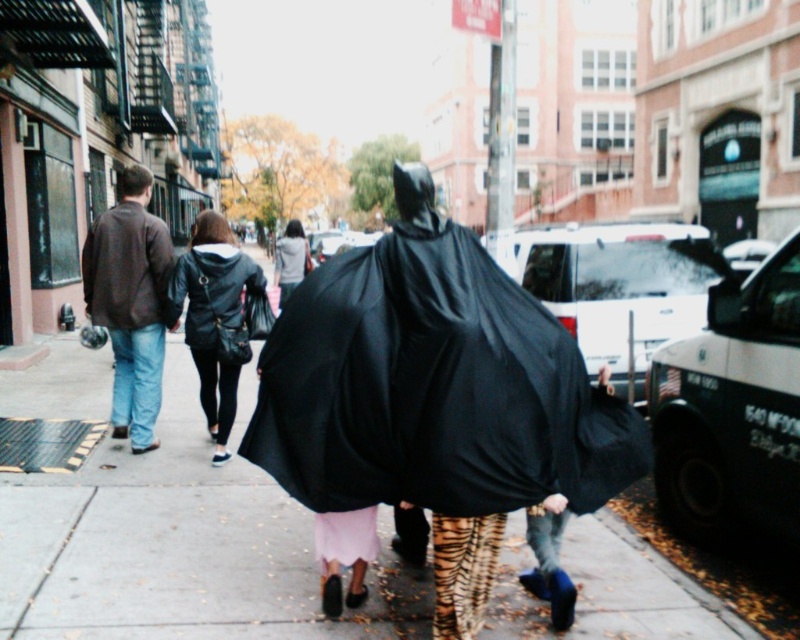
You are a pedestrian standing on the gray concrete sidewalk at center and want to walk towards the light gray hoodie at center. Which direction should you move to reach them?

The gray concrete sidewalk at center is positioned on the right side of light gray hoodie at center, so you should move to the left to reach them.